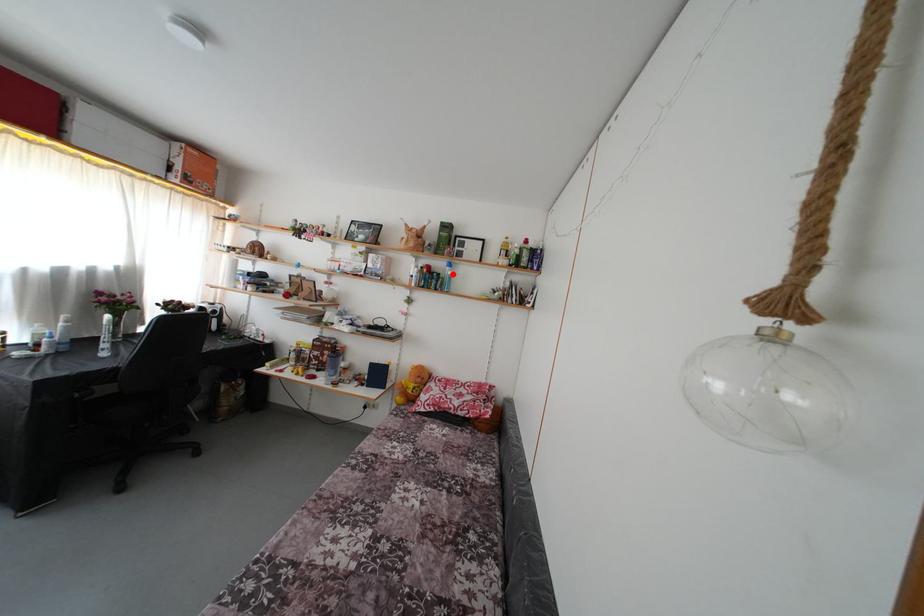
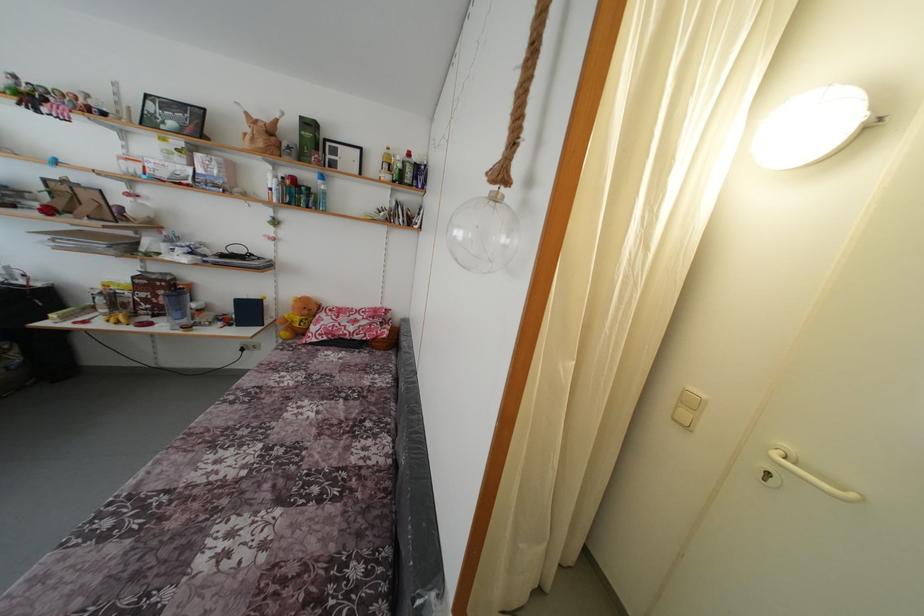
Locate, in the second image, the point that corresponds to the highlighted location in the first image.

(324, 188)